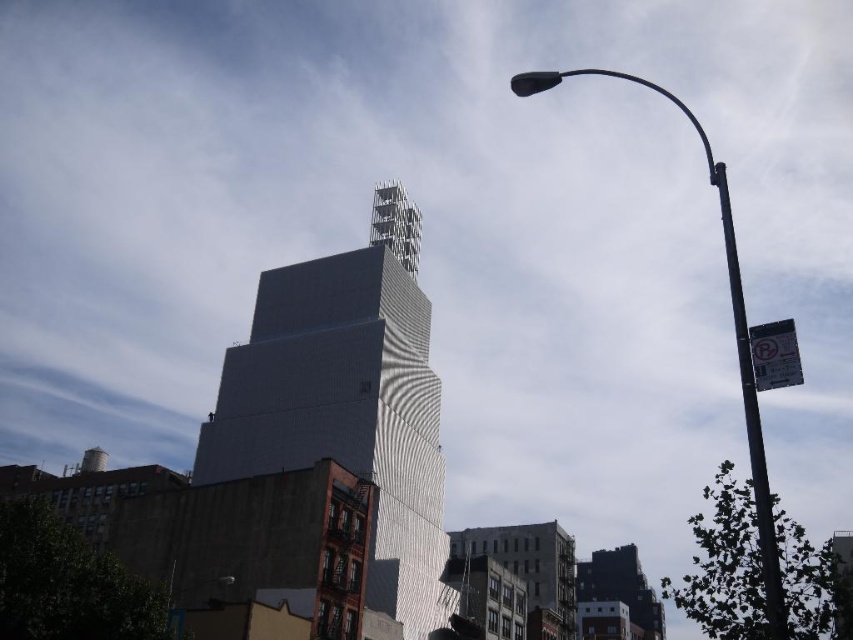
Does silver metallic building at center have a lesser width compared to metallic street light at upper right?

In fact, silver metallic building at center might be wider than metallic street light at upper right.

Between point (387, 465) and point (181, 624), which one is positioned behind?

Point (387, 465)

Is point (339, 280) in front of point (216, 580)?

No, it is behind (216, 580).

Locate an element on the screen. The image size is (853, 640). silver metallic building at center is located at coordinates (347, 401).

Who is taller, silver metallic building at center or black metal pole at right?

black metal pole at right is taller.

Does silver metallic building at center appear over black metal pole at right?

No, silver metallic building at center is not above black metal pole at right.

Is point (245, 410) positioned after point (769, 580)?

Yes, it is behind point (769, 580).

This screenshot has height=640, width=853. Identify the location of silver metallic building at center. (347, 401).

Image resolution: width=853 pixels, height=640 pixels. Find the location of `metallic pole at right`. metallic pole at right is located at coordinates (734, 332).

Measure the distance between point (770, 620) and camera.

Point (770, 620) and camera are 62.74 feet apart.

Between point (552, 76) and point (181, 637), which one is positioned behind?

Positioned behind is point (181, 637).

At what (x,y) coordinates should I click in order to perform the action: click on metallic pole at right. Please return your answer as a coordinate pair (x, y). Looking at the image, I should click on (734, 332).